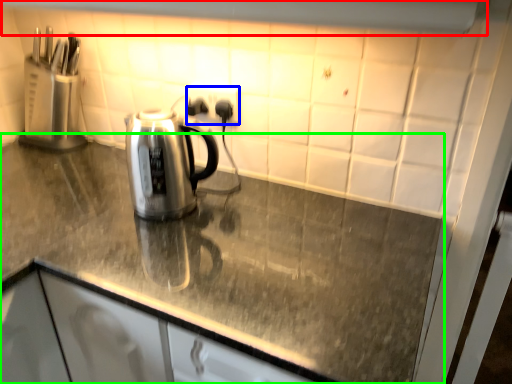
Question: Based on their relative distances, which object is nearer to exhaust hood (highlighted by a red box)? Choose from electric outlet (highlighted by a blue box) and countertop (highlighted by a green box).

Choices:
 (A) electric outlet
 (B) countertop

Answer: (A)